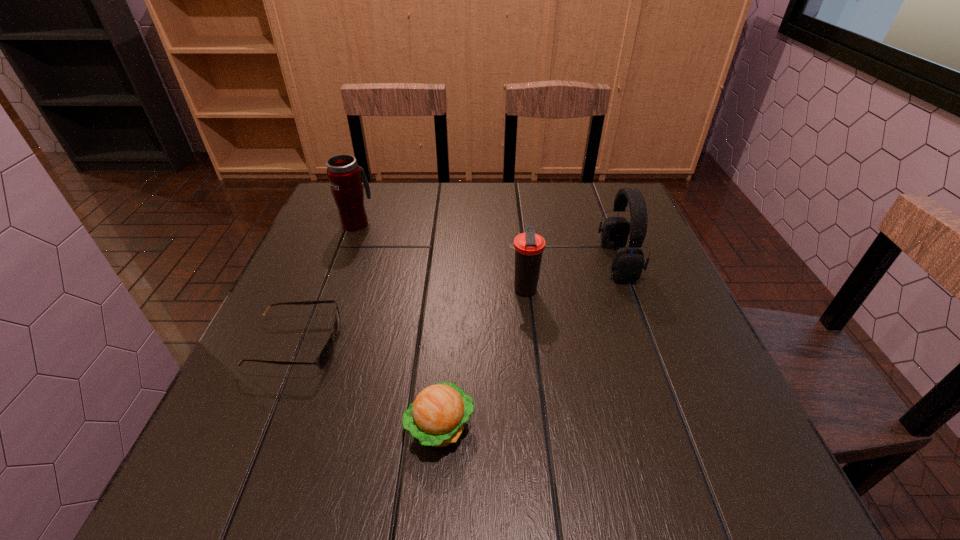
The width and height of the screenshot is (960, 540). Identify the location of the rightmost object. (627, 266).

The width and height of the screenshot is (960, 540). In order to click on the left thermos bottle in this screenshot , I will do `click(344, 175)`.

Where is `the farther thermos bottle`? The height and width of the screenshot is (540, 960). the farther thermos bottle is located at coordinates (344, 175).

Image resolution: width=960 pixels, height=540 pixels. Find the location of `the second object from right to left`. the second object from right to left is located at coordinates (529, 247).

At what (x,y) coordinates should I click in order to perform the action: click on the right thermos bottle. Please return your answer as a coordinate pair (x, y). The width and height of the screenshot is (960, 540). Looking at the image, I should click on (529, 247).

The height and width of the screenshot is (540, 960). I want to click on hamburger, so click(x=437, y=417).

In order to click on the nearest object in this screenshot , I will do `click(437, 417)`.

Identify the location of the shortest object. (324, 357).

Where is `sunglasses`? The height and width of the screenshot is (540, 960). sunglasses is located at coordinates (324, 357).

Identify the location of free space located 0.290m on the headband of the rightmost object. (483, 261).